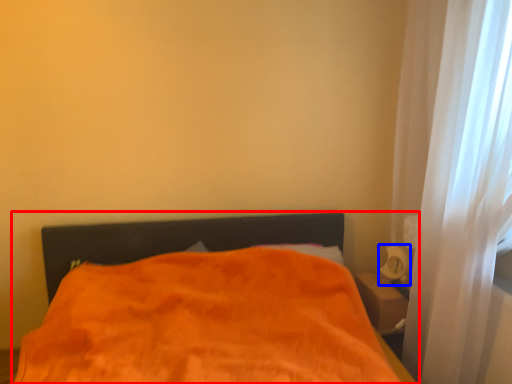
Question: Which object is closer to the camera taking this photo, bed (highlighted by a red box) or table lamp (highlighted by a blue box)?

Choices:
 (A) bed
 (B) table lamp

Answer: (A)